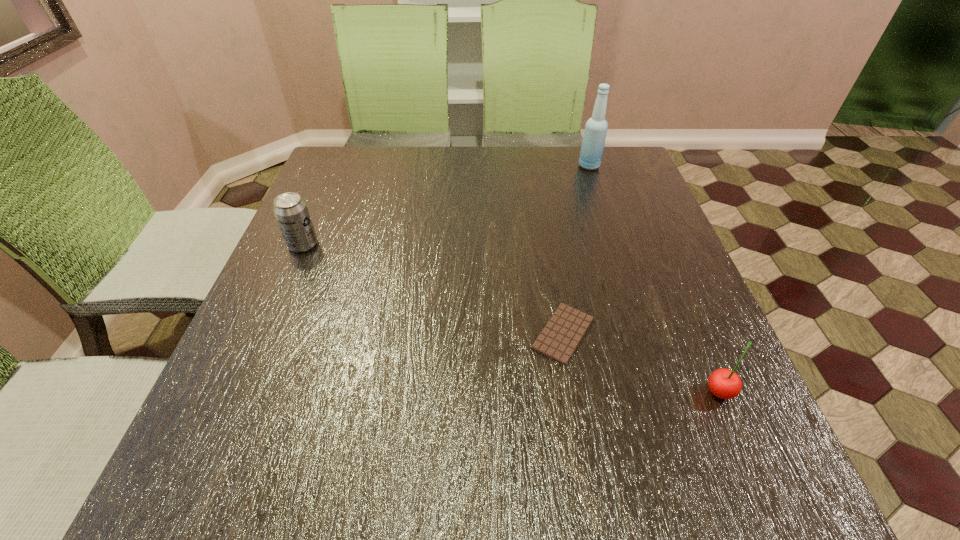
The height and width of the screenshot is (540, 960). What are the coordinates of `free spot between the third tallest object and the third farthest object` in the screenshot? It's located at (641, 362).

Find the location of a particular element. free space between the second shortest object and the chocolate bar is located at coordinates click(x=641, y=362).

The image size is (960, 540). I want to click on vacant area between the chocolate bar and the beer can, so click(433, 289).

You are a GUI agent. You are given a task and a screenshot of the screen. Output one action in this format:
    pyautogui.click(x=<x>, y=<y>)
    Task: Click on the object that ranks as the third closest to the cherry
    The height and width of the screenshot is (540, 960).
    Given the screenshot: What is the action you would take?
    pyautogui.click(x=291, y=212)

Select which object appears as the second closest to the cherry. Please provide its 2D coordinates. Your answer should be formatted as a tuple, i.e. [(x, y)], where the tuple contains the x and y coordinates of a point satisfying the conditions above.

[(596, 127)]

This screenshot has height=540, width=960. I want to click on vacant region that satisfies the following two spatial constraints: 1. on the front side of the shortest object; 2. on the right side of the second tallest object, so click(x=265, y=334).

This screenshot has width=960, height=540. In order to click on vacant position in the image that satisfies the following two spatial constraints: 1. on the front side of the nearest object; 2. on the left side of the chocolate bar in this screenshot , I will do `click(573, 391)`.

Find the location of a particular element. The height and width of the screenshot is (540, 960). free space that satisfies the following two spatial constraints: 1. on the back side of the farthest object; 2. on the right side of the leftmost object is located at coordinates (337, 166).